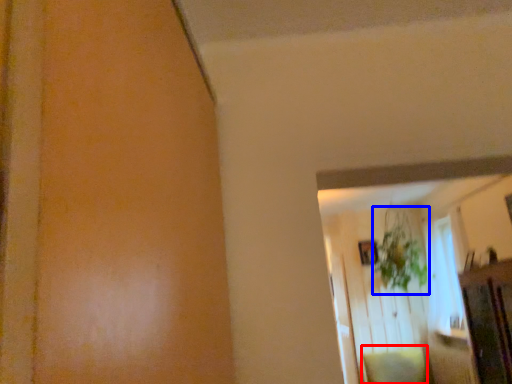
Question: Which point is closer to the camera, pillow (highlighted by a red box) or plant (highlighted by a blue box)?

Choices:
 (A) pillow
 (B) plant

Answer: (A)